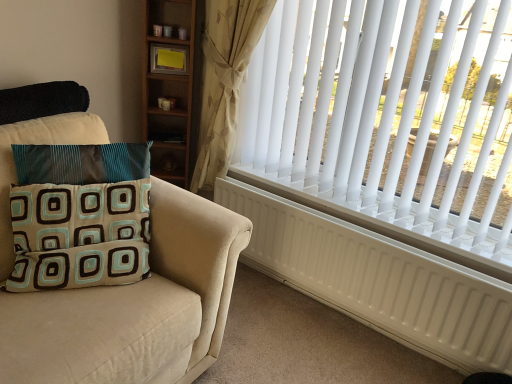
Question: From the image's perspective, is white plastic blinds at upper right positioned above or below teal and brown fabric pillow at left?

Choices:
 (A) above
 (B) below

Answer: (A)

Question: In the image, is white plastic blinds at upper right positioned in front of or behind teal and brown fabric pillow at left?

Choices:
 (A) behind
 (B) front

Answer: (A)

Question: Estimate the real-world distances between objects in this image. Which object is closer to the white matte radiator at right?

Choices:
 (A) white plastic blinds at upper right
 (B) teal and brown fabric pillow at left
 (C) beige floral fabric curtain at upper right

Answer: (A)

Question: Which object is positioned closest to the white plastic blinds at upper right?

Choices:
 (A) teal and brown fabric pillow at left
 (B) beige floral fabric curtain at upper right
 (C) white matte radiator at right

Answer: (C)